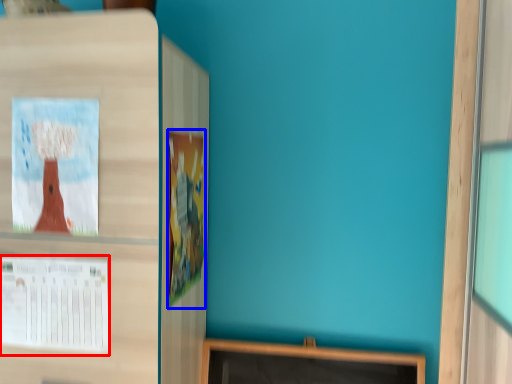
Question: Which object appears closest to the camera in this image, poster (highlighted by a red box) or poster (highlighted by a blue box)?

Choices:
 (A) poster
 (B) poster

Answer: (A)